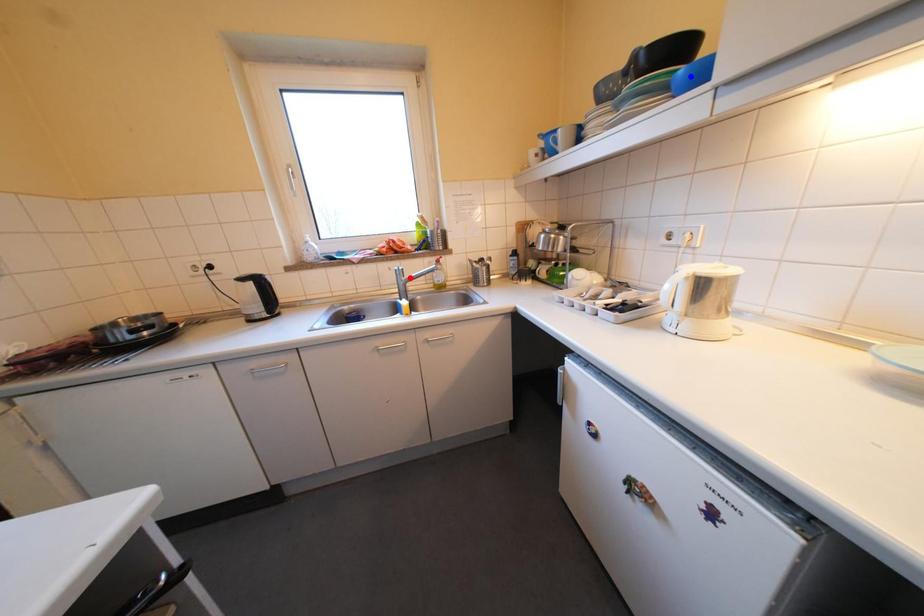
Question: Two points are marked on the image. Which point is closer to the camera?

Choices:
 (A) Blue point is closer.
 (B) Red point is closer.

Answer: (A)